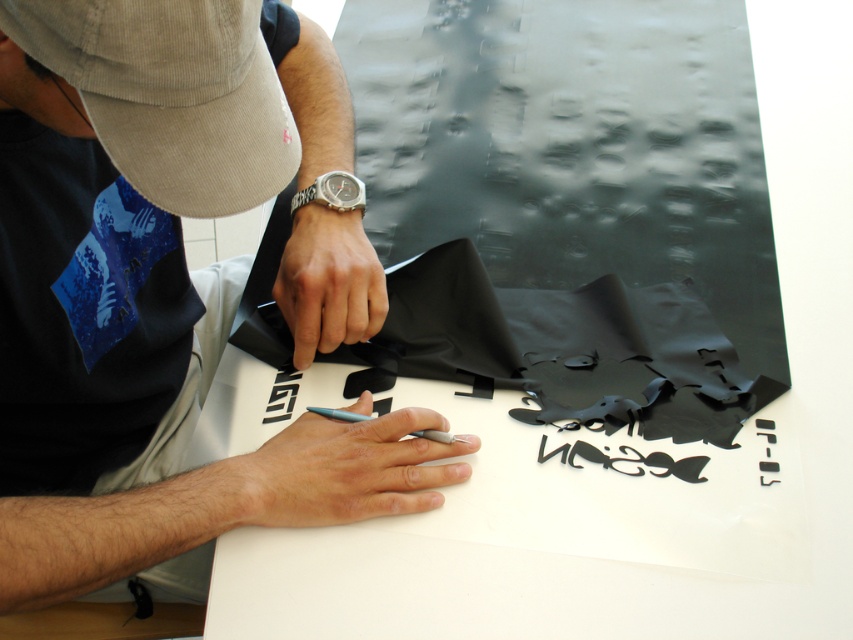
Which is behind, point (347, 184) or point (293, 369)?

Point (293, 369)

Between silver metallic watch at center and black paper cutout at center, which one has less height?

silver metallic watch at center

Where is `silver metallic watch at center`? silver metallic watch at center is located at coordinates (332, 193).

Who is positioned more to the right, matte black paper at center or black paper cutout at center?

matte black paper at center is more to the right.

Which is behind, point (51, 336) or point (276, 406)?

The point (276, 406) is more distant.

The height and width of the screenshot is (640, 853). Identify the location of matte black paper at center. (155, 289).

Which is more to the right, matte black paper at center or silver metallic watch at center?

From the viewer's perspective, silver metallic watch at center appears more on the right side.

Who is shorter, matte black paper at center or silver metallic watch at center?

silver metallic watch at center

You are a GUI agent. You are given a task and a screenshot of the screen. Output one action in this format:
    pyautogui.click(x=<x>, y=<y>)
    Task: Click on the matte black paper at center
    
    Given the screenshot: What is the action you would take?
    pyautogui.click(x=155, y=289)

Find the location of a particular element. matte black paper at center is located at coordinates (155, 289).